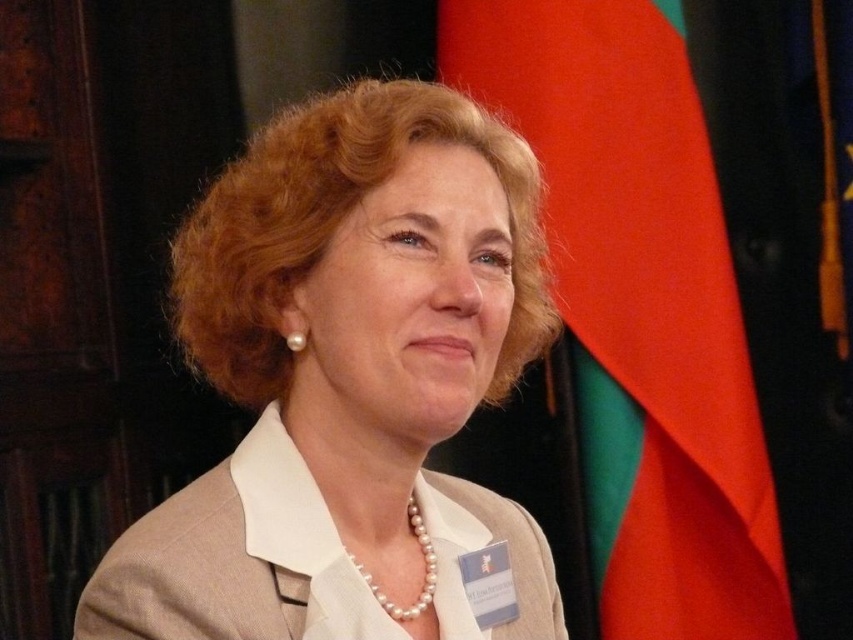
Question: Does red fabric flag at right have a greater width compared to beige fabric business suit at center?

Choices:
 (A) no
 (B) yes

Answer: (B)

Question: Which of the following is the closest to the observer?

Choices:
 (A) pearl necklace at center
 (B) matte beige suit at center
 (C) red fabric flag at right

Answer: (B)

Question: Can you confirm if matte beige suit at center is smaller than red fabric flag at right?

Choices:
 (A) no
 (B) yes

Answer: (B)

Question: Which point is farther from the camera taking this photo?

Choices:
 (A) (573, 198)
 (B) (173, 554)
 (C) (386, 608)
 (D) (364, 324)

Answer: (A)

Question: Observing the image, what is the correct spatial positioning of matte beige suit at center in reference to red fabric flag at right?

Choices:
 (A) left
 (B) right

Answer: (A)

Question: Considering the real-world distances, which object is farthest from the beige fabric business suit at center?

Choices:
 (A) matte beige suit at center
 (B) pearl necklace at center
 (C) red fabric flag at right

Answer: (C)